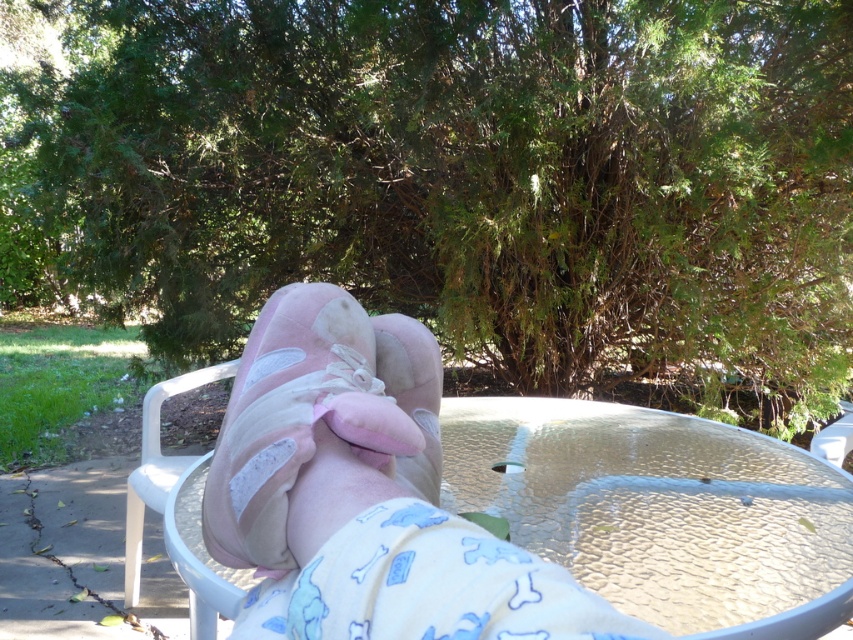
Question: Which point is closer to the camera?

Choices:
 (A) clear glass table at center
 (B) pink suede slippers at center

Answer: (B)

Question: From the image, what is the correct spatial relationship of clear glass table at center in relation to pink suede slippers at center?

Choices:
 (A) below
 (B) above

Answer: (A)

Question: Is clear glass table at center smaller than pink suede slippers at center?

Choices:
 (A) no
 (B) yes

Answer: (A)

Question: Is the position of clear glass table at center more distant than that of pink suede slippers at center?

Choices:
 (A) yes
 (B) no

Answer: (A)

Question: Which object appears closest to the camera in this image?

Choices:
 (A) clear glass table at center
 (B) pink suede slippers at center

Answer: (B)